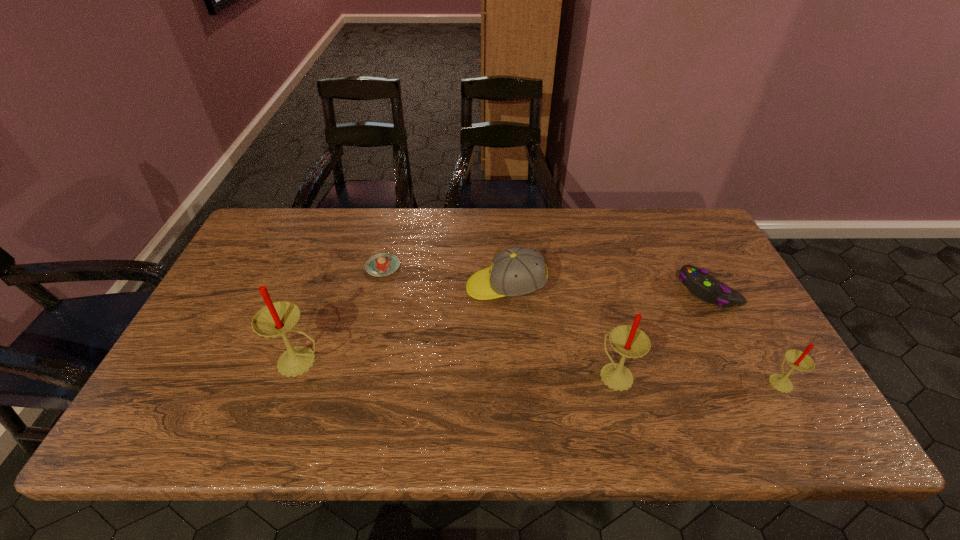
Locate an element on the screen. vacant space at the far edge of the desktop is located at coordinates (467, 238).

In the image, there is a desktop. At what (x,y) coordinates should I click in order to perform the action: click on vacant area at the near edge. Please return your answer as a coordinate pair (x, y). Image resolution: width=960 pixels, height=540 pixels. Looking at the image, I should click on (494, 381).

Find the location of a particular element. This screenshot has height=540, width=960. vacant space at the left edge of the desktop is located at coordinates (256, 272).

This screenshot has height=540, width=960. In order to click on free space at the right edge in this screenshot , I will do `click(700, 265)`.

The image size is (960, 540). In order to click on vacant space at the far left corner of the desktop in this screenshot , I will do `click(299, 211)`.

Identify the location of vacant space at the near left corner of the desktop. (154, 403).

The image size is (960, 540). Find the location of `vacant space at the far right corner`. vacant space at the far right corner is located at coordinates (682, 236).

Find the location of a particular element. This screenshot has width=960, height=540. free spot between the fifth object from right to left and the third object from left to right is located at coordinates (444, 277).

Identify the location of free space between the leftmost candle and the rightmost candle. (540, 371).

The width and height of the screenshot is (960, 540). I want to click on free area in between the third object from right to left and the leftmost candle, so click(459, 368).